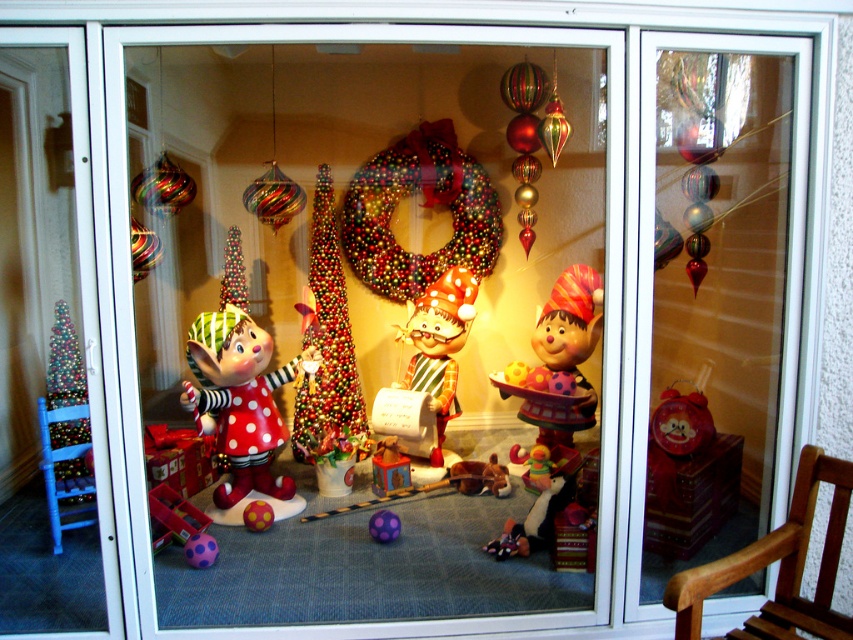
Can you confirm if glossy fabric wreath at center is wider than shiny metallic christmas tree at center?

Indeed, glossy fabric wreath at center has a greater width compared to shiny metallic christmas tree at center.

Find the location of `glossy fabric wreath at center`. glossy fabric wreath at center is located at coordinates (422, 205).

Is polka dot fabric elf at center smaller than wooden rocking chair at lower right?

No, polka dot fabric elf at center is not smaller than wooden rocking chair at lower right.

Is point (245, 410) more distant than point (769, 618)?

Yes, it is.

At what (x,y) coordinates should I click in order to perform the action: click on polka dot fabric elf at center. Please return your answer as a coordinate pair (x, y). Looking at the image, I should click on (241, 404).

Image resolution: width=853 pixels, height=640 pixels. Identify the location of polka dot fabric elf at center. 241,404.

Who is more distant from viewer, (x=393, y=192) or (x=775, y=547)?

The point (x=393, y=192) is behind.

I want to click on glossy fabric wreath at center, so click(422, 205).

Identify the location of glossy fabric wreath at center. (422, 205).